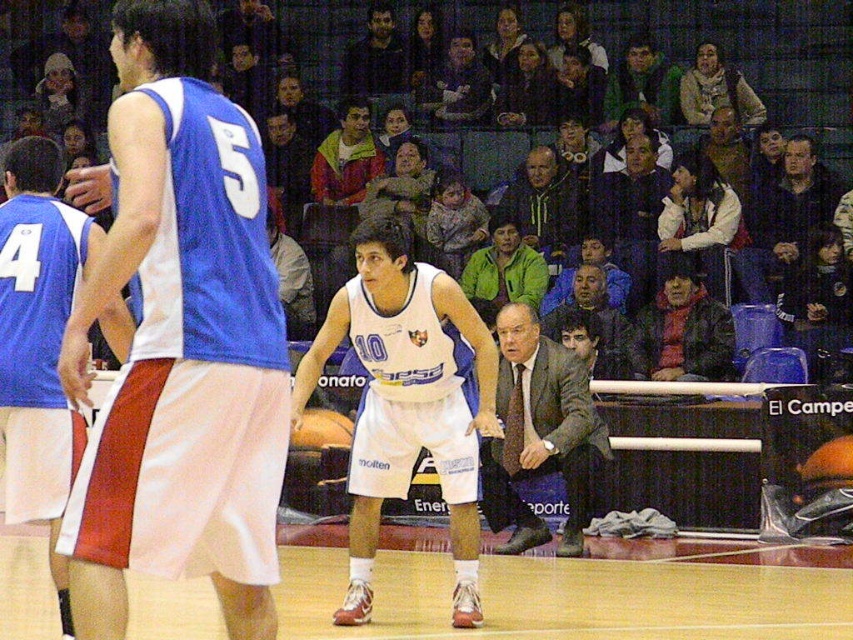
Question: Does white jersey at center appear on the left side of dark brown leather jacket at center?

Choices:
 (A) no
 (B) yes

Answer: (B)

Question: Which point is farther to the camera?

Choices:
 (A) dark blue suit at center
 (B) white jersey at center

Answer: (A)

Question: Among these points, which one is farthest from the camera?

Choices:
 (A) (28, 486)
 (B) (596, 310)

Answer: (B)

Question: Observing the image, what is the correct spatial positioning of blue jersey at center in reference to wooden floor at center?

Choices:
 (A) below
 (B) above

Answer: (B)

Question: Does white matte basketball player at center appear under dark gray suit at center?

Choices:
 (A) no
 (B) yes

Answer: (A)

Question: Which point is farther to the camera?

Choices:
 (A) dark brown leather jacket at center
 (B) blue jersey at center
 (C) dark blue suit at center
 (D) dark blue jacket at center

Answer: (C)